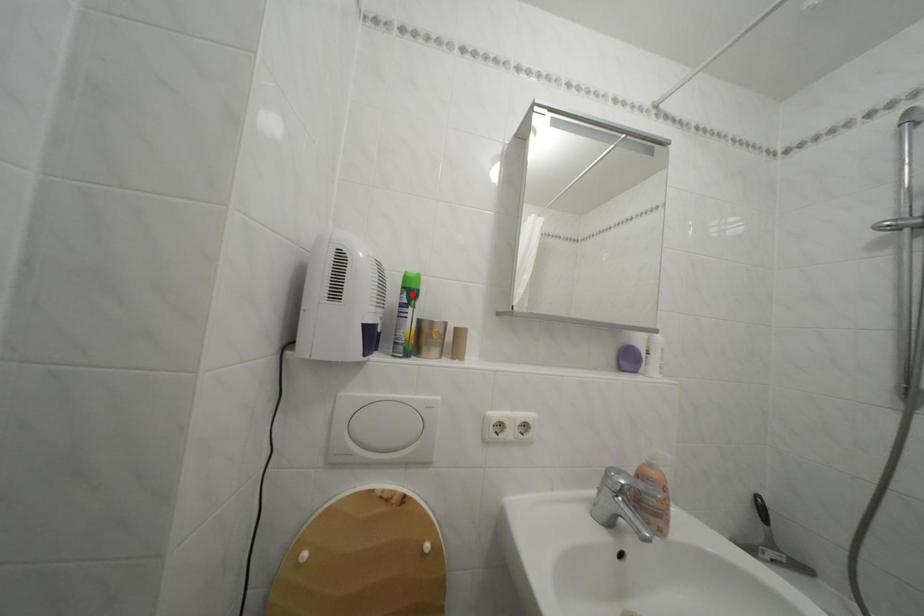
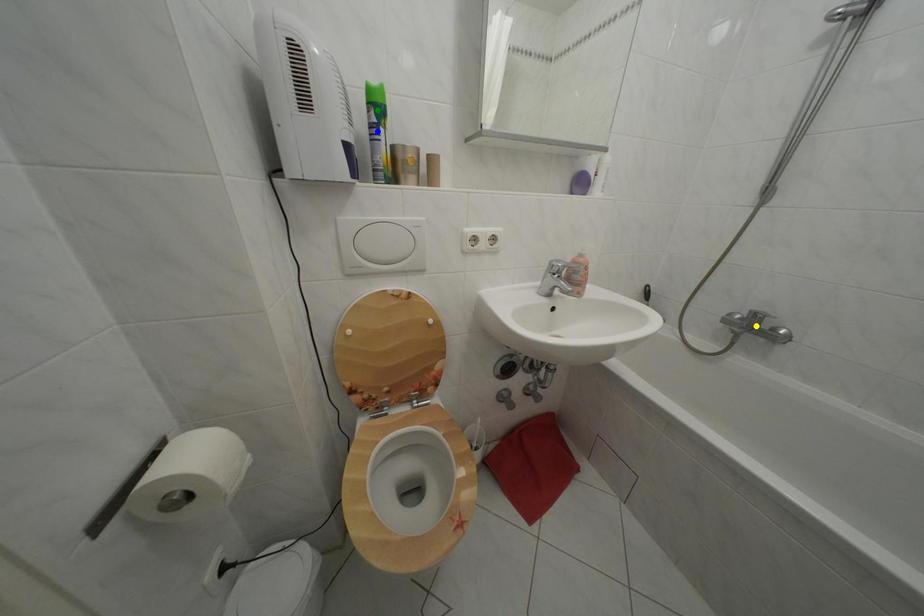
Question: I am providing you with two images of the same scene from different viewpoints. A red point is marked on the first image. You are given multiple points on the second image. Can you choose the point in image 2 that corresponds to the point in image 1?

Choices:
 (A) blue point
 (B) yellow point
 (C) green point

Answer: (C)